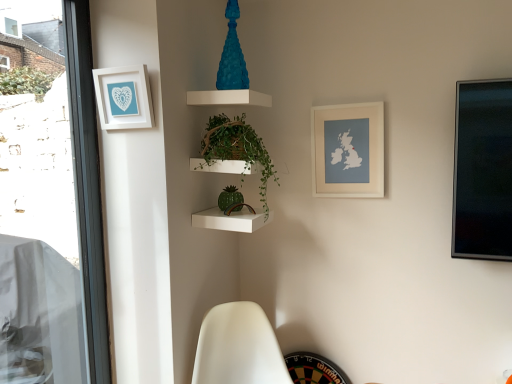
Question: Is white matte swivel chair at lower center not near white matte map at upper right, positioned as the 2th picture frame in left-to-right order?

Choices:
 (A) no
 (B) yes

Answer: (A)

Question: From the image's perspective, is white matte swivel chair at lower center over white matte map at upper right, which is the 2th picture frame in front-to-back order?

Choices:
 (A) no
 (B) yes

Answer: (A)

Question: Is white matte swivel chair at lower center not within white matte map at upper right, positioned as the 2th picture frame in left-to-right order?

Choices:
 (A) yes
 (B) no

Answer: (A)

Question: Does white matte swivel chair at lower center lie in front of white matte map at upper right, positioned as the 2th picture frame in left-to-right order?

Choices:
 (A) yes
 (B) no

Answer: (A)

Question: Does white matte swivel chair at lower center have a smaller size compared to white matte map at upper right, which is the 2th picture frame in front-to-back order?

Choices:
 (A) no
 (B) yes

Answer: (A)

Question: Is white matte swivel chair at lower center taller than white matte map at upper right, positioned as the 2th picture frame in left-to-right order?

Choices:
 (A) no
 (B) yes

Answer: (B)

Question: Is white matte swivel chair at lower center smaller than green glossy plant at center?

Choices:
 (A) yes
 (B) no

Answer: (B)

Question: Can you confirm if white matte swivel chair at lower center is wider than green glossy plant at center?

Choices:
 (A) yes
 (B) no

Answer: (A)

Question: Would you consider white matte swivel chair at lower center to be distant from green glossy plant at center?

Choices:
 (A) yes
 (B) no

Answer: (B)

Question: Considering the relative sizes of white matte swivel chair at lower center and green glossy plant at center in the image provided, is white matte swivel chair at lower center thinner than green glossy plant at center?

Choices:
 (A) yes
 (B) no

Answer: (B)

Question: Is white matte swivel chair at lower center facing away from green glossy plant at center?

Choices:
 (A) no
 (B) yes

Answer: (A)

Question: From the image's perspective, does white matte swivel chair at lower center appear lower than green glossy plant at center?

Choices:
 (A) no
 (B) yes

Answer: (B)

Question: Is white matte swivel chair at lower center completely or partially inside green glossy plant at center?

Choices:
 (A) yes
 (B) no

Answer: (B)